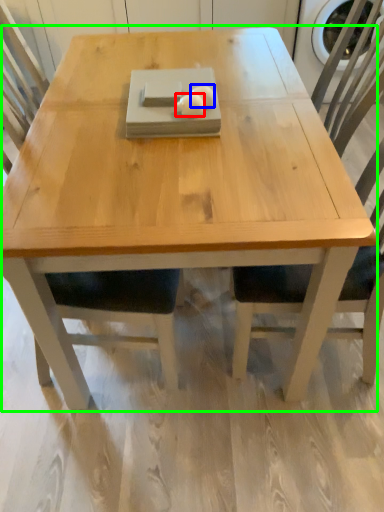
Question: Which object is the farthest from food (highlighted by a red box)? Choose among these: food (highlighted by a blue box) or coffee table (highlighted by a green box).

Choices:
 (A) food
 (B) coffee table

Answer: (B)